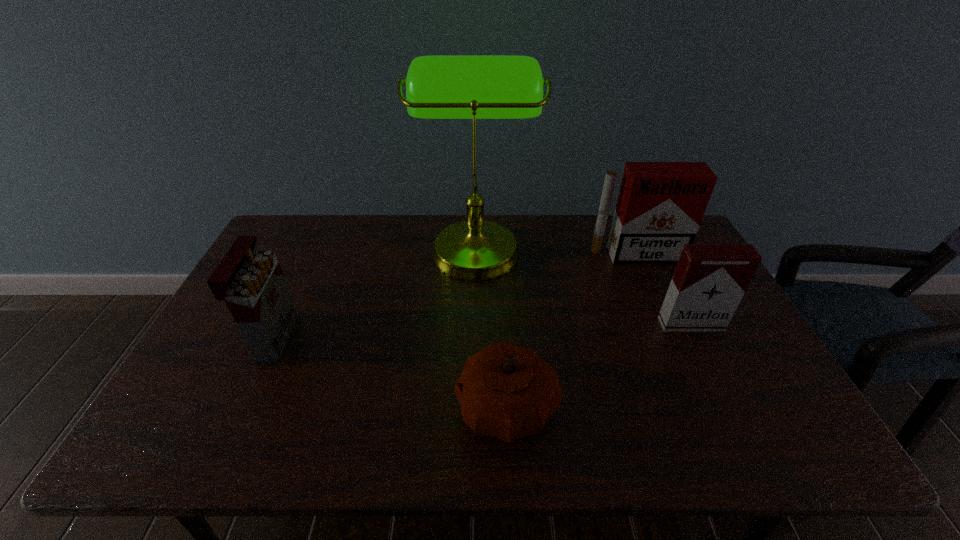
Locate an element on the screen. cigarette_case that is the third nearest to the nearest object is located at coordinates (251, 282).

Locate an element on the screen. vacant space that satisfies the following two spatial constraints: 1. on the front-facing side of the farthest cigarette_case; 2. on the front-facing side of the shortest object is located at coordinates (702, 407).

The height and width of the screenshot is (540, 960). Identify the location of vacant space that satisfies the following two spatial constraints: 1. on the front-facing side of the farthest cigarette_case; 2. with the lid open on the leftmost cigarette_case. (671, 336).

At what (x,y) coordinates should I click in order to perform the action: click on free space that satisfies the following two spatial constraints: 1. on the front-facing side of the farthest cigarette_case; 2. with the lid open on the leftmost cigarette_case. Please return your answer as a coordinate pair (x, y). Looking at the image, I should click on (671, 336).